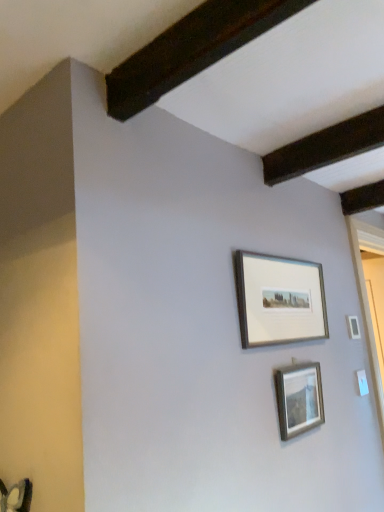
Question: Does point (284, 308) appear closer or farther from the camera than point (292, 398)?

Choices:
 (A) closer
 (B) farther

Answer: (B)

Question: Is silver metallic picture frame at upper center, the first picture frame when ordered from top to bottom, bigger or smaller than silver metallic picture frame at center, which appears as the 1th picture frame when ordered from the bottom?

Choices:
 (A) small
 (B) big

Answer: (B)

Question: From a real-world perspective, is silver metallic picture frame at upper center, the first picture frame when ordered from top to bottom, positioned above or below silver metallic picture frame at center, acting as the second picture frame starting from the top?

Choices:
 (A) below
 (B) above

Answer: (B)

Question: Do you think silver metallic picture frame at center, acting as the second picture frame starting from the top, is within silver metallic picture frame at upper center, the second picture frame from the bottom, or outside of it?

Choices:
 (A) outside
 (B) inside

Answer: (A)

Question: In terms of height, does silver metallic picture frame at center, which appears as the 1th picture frame when ordered from the bottom, look taller or shorter compared to silver metallic picture frame at upper center, the first picture frame when ordered from top to bottom?

Choices:
 (A) tall
 (B) short

Answer: (B)

Question: From a real-world perspective, is silver metallic picture frame at center, acting as the second picture frame starting from the top, physically located above or below silver metallic picture frame at upper center, the first picture frame when ordered from top to bottom?

Choices:
 (A) below
 (B) above

Answer: (A)

Question: Is silver metallic picture frame at center, which appears as the 1th picture frame when ordered from the bottom, in front of or behind silver metallic picture frame at upper center, the first picture frame when ordered from top to bottom, in the image?

Choices:
 (A) behind
 (B) front

Answer: (A)